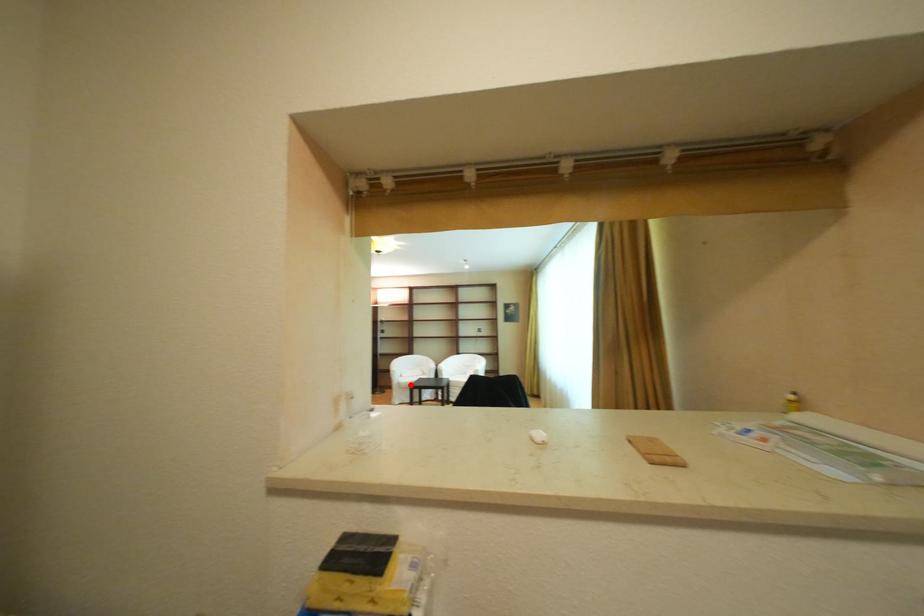
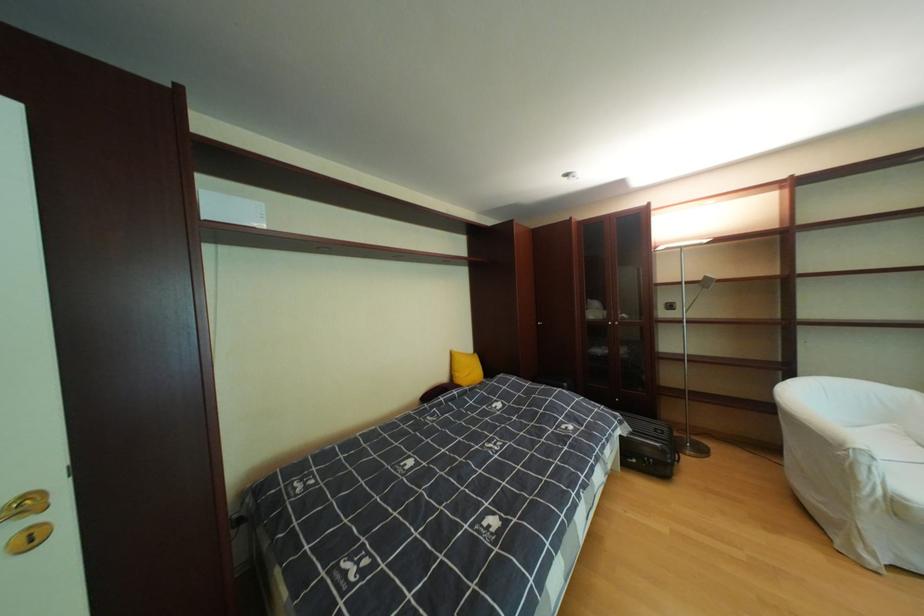
Find the pixel in the second image that matches the highlighted location in the first image.

(908, 506)